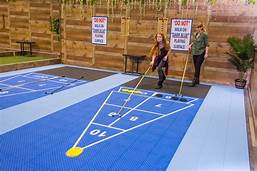
The width and height of the screenshot is (257, 171). Find the location of `black table`. black table is located at coordinates (134, 55), (25, 42).